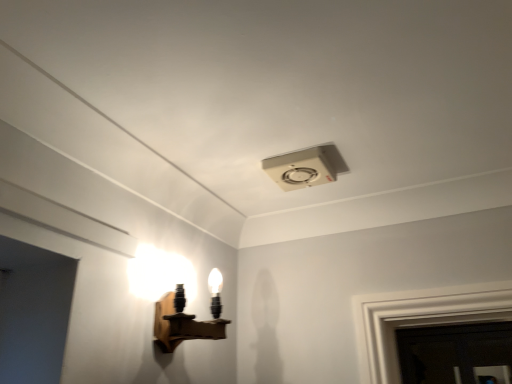
Question: Is white plastic ceiling fan at upper center, which appears as the first lamp when viewed from the right, positioned before wooden wall sconce at left, the 1th lamp when ordered from bottom to top?

Choices:
 (A) no
 (B) yes

Answer: (A)

Question: Is white plastic ceiling fan at upper center, which appears as the first lamp when viewed from the right, not within wooden wall sconce at left, the second lamp viewed from the right?

Choices:
 (A) no
 (B) yes

Answer: (B)

Question: Does white plastic ceiling fan at upper center, the second lamp when ordered from bottom to top, have a greater height compared to wooden wall sconce at left, which is the 1th lamp from left to right?

Choices:
 (A) no
 (B) yes

Answer: (A)

Question: Is white plastic ceiling fan at upper center, which is the first lamp from top to bottom, oriented towards wooden wall sconce at left, the 1th lamp when ordered from bottom to top?

Choices:
 (A) yes
 (B) no

Answer: (B)

Question: Does white plastic ceiling fan at upper center, which is the 2th lamp in left-to-right order, have a lesser height compared to wooden wall sconce at left, the second lamp viewed from the right?

Choices:
 (A) yes
 (B) no

Answer: (A)

Question: From the image's perspective, is white plastic ceiling fan at upper center, which is the first lamp from top to bottom, below wooden wall sconce at left, the 1th lamp when ordered from bottom to top?

Choices:
 (A) no
 (B) yes

Answer: (A)

Question: Is wooden wall sconce at left, the second lamp viewed from the right, closer to camera compared to white plastic ceiling fan at upper center, which appears as the first lamp when viewed from the right?

Choices:
 (A) no
 (B) yes

Answer: (B)

Question: Can you confirm if wooden wall sconce at left, which is the 1th lamp from left to right, is wider than white plastic ceiling fan at upper center, which is the 2th lamp in left-to-right order?

Choices:
 (A) yes
 (B) no

Answer: (B)

Question: From a real-world perspective, is wooden wall sconce at left, which appears as the 2th lamp when viewed from the top, physically below white plastic ceiling fan at upper center, which is the 2th lamp in left-to-right order?

Choices:
 (A) yes
 (B) no

Answer: (A)

Question: Is wooden wall sconce at left, the second lamp viewed from the right, further to the viewer compared to white plastic ceiling fan at upper center, which is the first lamp from top to bottom?

Choices:
 (A) yes
 (B) no

Answer: (B)

Question: Would you say wooden wall sconce at left, which appears as the 2th lamp when viewed from the top, is outside white plastic ceiling fan at upper center, which is the 2th lamp in left-to-right order?

Choices:
 (A) yes
 (B) no

Answer: (A)

Question: Is wooden wall sconce at left, the 1th lamp when ordered from bottom to top, to the left of white plastic ceiling fan at upper center, which appears as the first lamp when viewed from the right, from the viewer's perspective?

Choices:
 (A) no
 (B) yes

Answer: (B)

Question: Can you confirm if dark glass door at lower right is wider than wooden wall sconce at left, the 1th lamp when ordered from bottom to top?

Choices:
 (A) no
 (B) yes

Answer: (A)